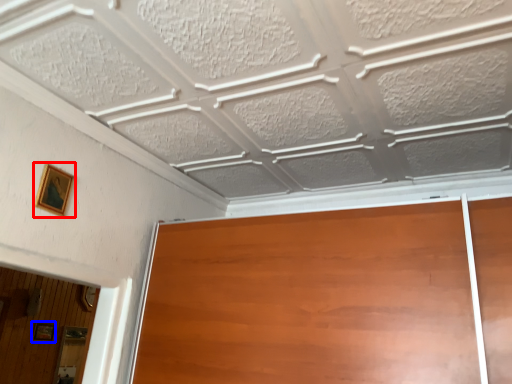
Question: Which object is closer to the camera taking this photo, picture frame (highlighted by a red box) or picture frame (highlighted by a blue box)?

Choices:
 (A) picture frame
 (B) picture frame

Answer: (A)